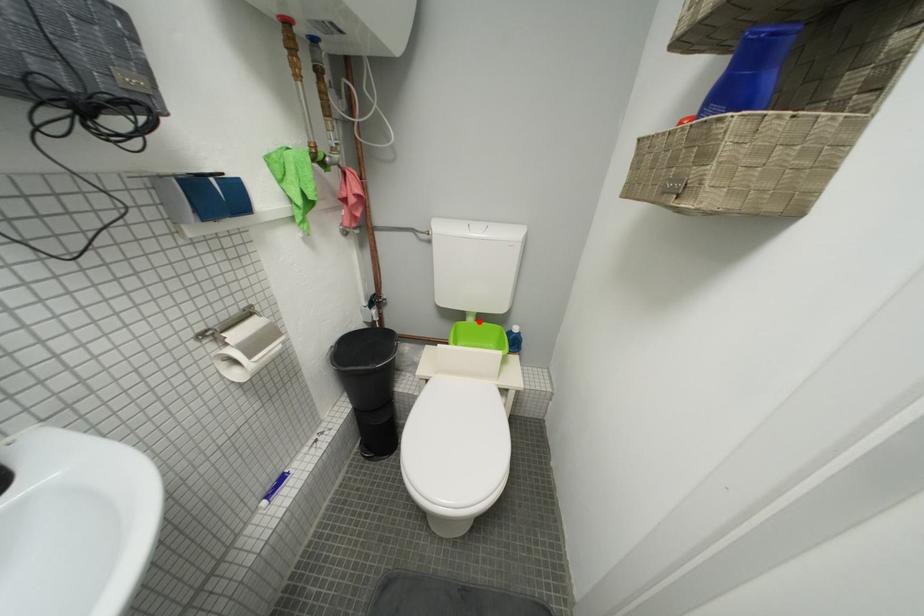
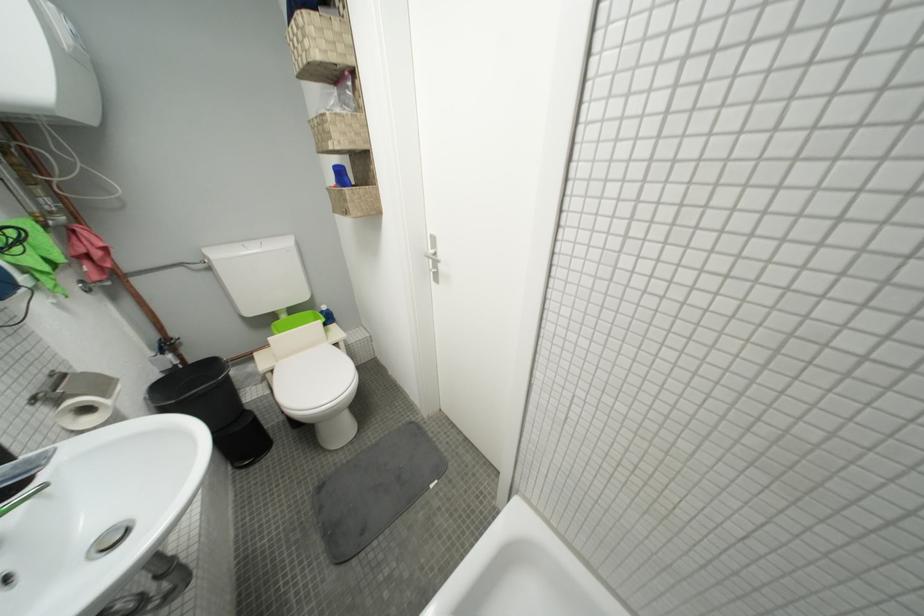
The point at the highlighted location is marked in the first image. Where is the corresponding point in the second image?

(293, 318)